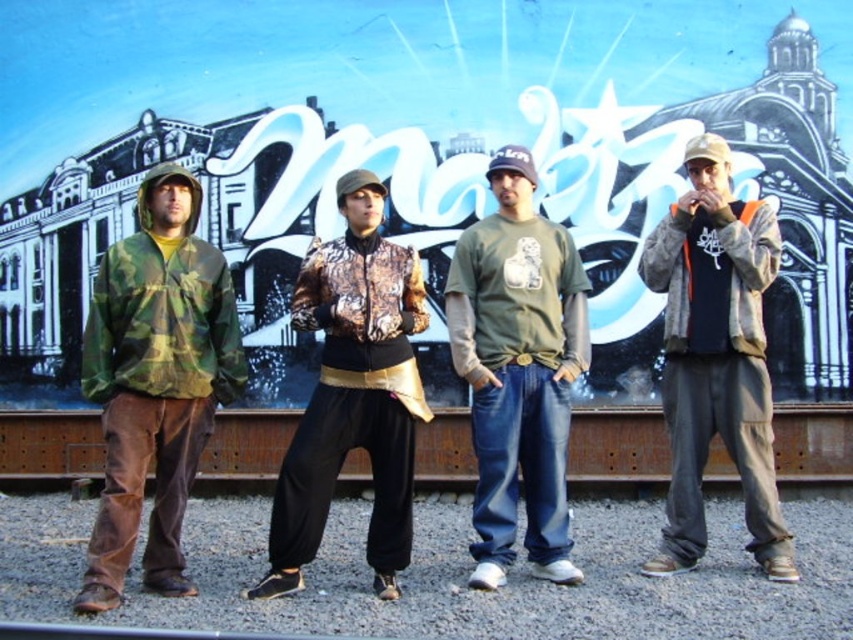
This screenshot has width=853, height=640. What do you see at coordinates (155, 381) in the screenshot?
I see `camouflage fabric jacket at left` at bounding box center [155, 381].

The height and width of the screenshot is (640, 853). I want to click on camouflage fabric jacket at left, so click(x=155, y=381).

Does camouflage fabric jacket at left have a greater height compared to metallic patterned jacket at center?

Yes, camouflage fabric jacket at left is taller than metallic patterned jacket at center.

Can you confirm if camouflage fabric jacket at left is bigger than metallic patterned jacket at center?

Correct, camouflage fabric jacket at left is larger in size than metallic patterned jacket at center.

Who is more forward, (128, 349) or (415, 285)?

Positioned in front is point (128, 349).

Where is `camouflage fabric jacket at left`? The height and width of the screenshot is (640, 853). camouflage fabric jacket at left is located at coordinates (155, 381).

Is metallic patterned jacket at center in front of dark gray cotton jacket at right?

Yes, metallic patterned jacket at center is in front of dark gray cotton jacket at right.

At what (x,y) coordinates should I click in order to perform the action: click on metallic patterned jacket at center. Please return your answer as a coordinate pair (x, y). Looking at the image, I should click on (352, 392).

Is point (271, 545) positioned behind point (741, 308)?

No, (271, 545) is closer to viewer.

Where is `metallic patterned jacket at center`? The width and height of the screenshot is (853, 640). metallic patterned jacket at center is located at coordinates (352, 392).